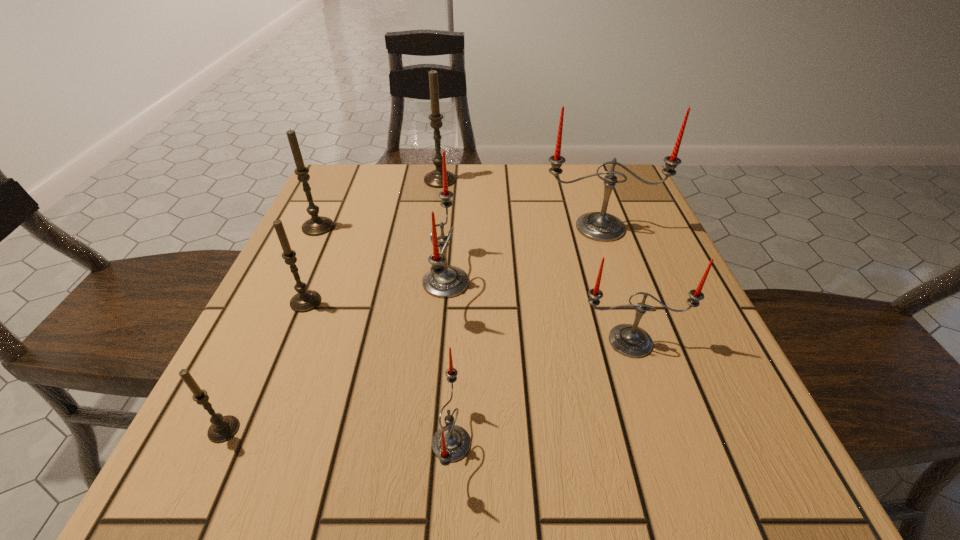
At what (x,y) coordinates should I click in order to perform the action: click on free region located 0.260m on the front of the farthest gray candle. Please return your answer as a coordinate pair (x, y). The height and width of the screenshot is (540, 960). Looking at the image, I should click on (430, 254).

Image resolution: width=960 pixels, height=540 pixels. Find the location of `free region located on the front-facing side of the farthest red candle`. free region located on the front-facing side of the farthest red candle is located at coordinates (663, 411).

Find the location of a particular element. This screenshot has height=540, width=960. vacant space situated 0.240m on the front of the third smallest gray candle is located at coordinates (276, 319).

Locate an element on the screen. vacant space located 0.350m on the front-facing side of the second farthest red candle is located at coordinates (654, 282).

The width and height of the screenshot is (960, 540). What are the coordinates of `free space located on the front-facing side of the sixth farthest candle` in the screenshot? It's located at (672, 470).

This screenshot has height=540, width=960. What are the coordinates of `blank space located on the front of the second smallest gray candle` in the screenshot? It's located at (243, 455).

Where is `vacant position located 0.150m on the back of the nearest gray candle`? vacant position located 0.150m on the back of the nearest gray candle is located at coordinates (268, 335).

Where is `free spot located 0.310m on the front-facing side of the nearest red candle`? This screenshot has width=960, height=540. free spot located 0.310m on the front-facing side of the nearest red candle is located at coordinates (700, 443).

Identify the location of object that is at the near left corner. This screenshot has height=540, width=960. (223, 428).

The image size is (960, 540). I want to click on object present at the far right corner, so click(599, 226).